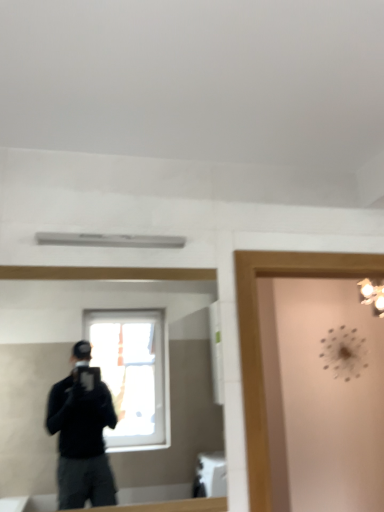
In order to click on clear glass mirror at center in this screenshot , I will do `click(69, 368)`.

The image size is (384, 512). What do you see at coordinates (69, 368) in the screenshot?
I see `clear glass mirror at center` at bounding box center [69, 368].

This screenshot has height=512, width=384. Identify the location of transparent glass door at upper right. (260, 340).

What do you see at coordinates (260, 340) in the screenshot? I see `transparent glass door at upper right` at bounding box center [260, 340].

Image resolution: width=384 pixels, height=512 pixels. What are the coordinates of `clear glass mirror at center` in the screenshot? It's located at (69, 368).

Which object is positioned more to the right, transparent glass door at upper right or clear glass mirror at center?

From the viewer's perspective, transparent glass door at upper right appears more on the right side.

Considering the relative positions of transparent glass door at upper right and clear glass mirror at center in the image provided, is transparent glass door at upper right behind clear glass mirror at center?

Yes.

Considering the positions of points (249, 311) and (187, 381), is point (249, 311) closer to camera compared to point (187, 381)?

Yes, point (249, 311) is in front of point (187, 381).

From the image's perspective, between transparent glass door at upper right and clear glass mirror at center, who is located below?

From the image's view, transparent glass door at upper right is below.

From a real-world perspective, is transparent glass door at upper right physically located above or below clear glass mirror at center?

Answer: In terms of real-world spatial position, transparent glass door at upper right is below clear glass mirror at center.

Considering the relative sizes of transparent glass door at upper right and clear glass mirror at center in the image provided, is transparent glass door at upper right thinner than clear glass mirror at center?

No.

Is transparent glass door at upper right taller or shorter than clear glass mirror at center?

transparent glass door at upper right is taller than clear glass mirror at center.

Does transparent glass door at upper right have a larger size compared to clear glass mirror at center?

Indeed, transparent glass door at upper right has a larger size compared to clear glass mirror at center.

Is transparent glass door at upper right completely or partially outside of clear glass mirror at center?

Yes, transparent glass door at upper right is not within clear glass mirror at center.

Is transparent glass door at upper right beside clear glass mirror at center?

transparent glass door at upper right and clear glass mirror at center are not in contact.

Is transparent glass door at upper right turned away from clear glass mirror at center?

That's not correct — transparent glass door at upper right is not looking away from clear glass mirror at center.

Can you tell me how much transparent glass door at upper right and clear glass mirror at center differ in facing direction?

transparent glass door at upper right and clear glass mirror at center are facing 0.662 degrees away from each other.

Locate an element on the screen. glass door located behind the clear glass mirror at center is located at coordinates (260, 340).

Can you confirm if clear glass mirror at center is positioned to the left of transparent glass door at upper right?

Yes.

Is the depth of clear glass mirror at center less than that of transparent glass door at upper right?

Yes, it is.

Between point (184, 413) and point (379, 267), which one is positioned behind?

The point (184, 413) is more distant.

From the picture: From the image's perspective, is clear glass mirror at center on top of transparent glass door at upper right?

Correct, clear glass mirror at center appears higher than transparent glass door at upper right in the image.

From a real-world perspective, which is physically below, clear glass mirror at center or transparent glass door at upper right?

transparent glass door at upper right, from a real-world perspective.

Between clear glass mirror at center and transparent glass door at upper right, which one has larger width?

transparent glass door at upper right is wider.

Which of these two, clear glass mirror at center or transparent glass door at upper right, stands shorter?

With less height is clear glass mirror at center.

Based on their sizes in the image, would you say clear glass mirror at center is bigger or smaller than transparent glass door at upper right?

clear glass mirror at center is smaller than transparent glass door at upper right.

Choose the correct answer: Is clear glass mirror at center inside transparent glass door at upper right or outside it?

clear glass mirror at center cannot be found inside transparent glass door at upper right.

Is clear glass mirror at center directly adjacent to transparent glass door at upper right?

No, clear glass mirror at center is not touching transparent glass door at upper right.

Could you tell me if clear glass mirror at center is facing transparent glass door at upper right?

No.

What are the coordinates of `glass door to the right of clear glass mirror at center` in the screenshot? It's located at tap(260, 340).

The height and width of the screenshot is (512, 384). I want to click on mirror that appears in front of the transparent glass door at upper right, so click(x=69, y=368).

You are a GUI agent. You are given a task and a screenshot of the screen. Output one action in this format:
    pyautogui.click(x=<x>, y=<y>)
    Task: Click on the glass door below the clear glass mirror at center (from the image's perspective)
    
    Given the screenshot: What is the action you would take?
    pyautogui.click(x=260, y=340)